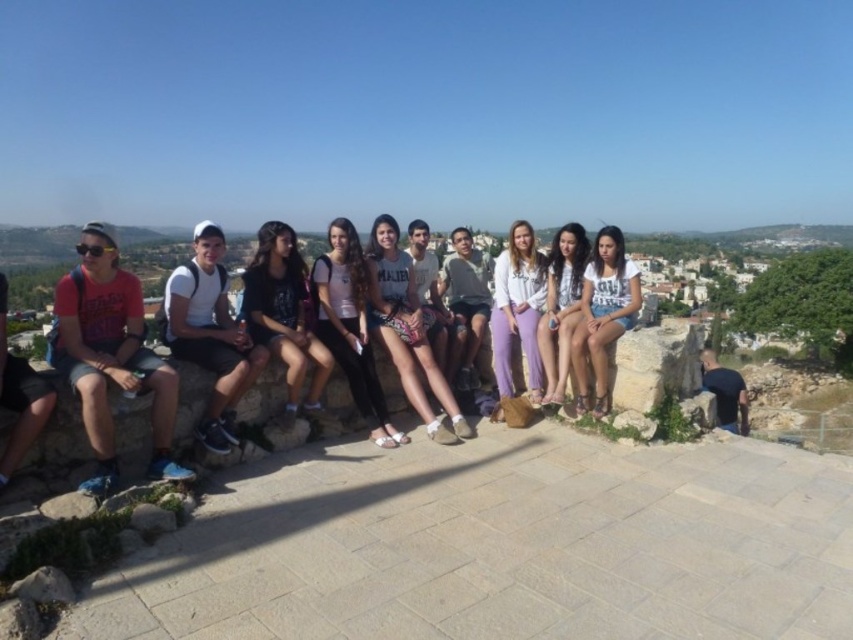
Question: Does white printed tank top at center appear on the right side of matte white shirt at center?

Choices:
 (A) yes
 (B) no

Answer: (A)

Question: Which point is closer to the camera taking this photo?

Choices:
 (A) (285, 376)
 (B) (184, 344)

Answer: (B)

Question: Does matte black jacket at center have a larger size compared to light purple cotton pants at center?

Choices:
 (A) yes
 (B) no

Answer: (A)

Question: Considering the relative positions of white printed tank top at center and matte white shirt at center in the image provided, where is white printed tank top at center located with respect to matte white shirt at center?

Choices:
 (A) below
 (B) above

Answer: (B)

Question: Which object is the farthest from the matte black jacket at center?

Choices:
 (A) light purple cotton pants at center
 (B) matte red t-shirt at left
 (C) white printed tank top at center
 (D) matte white shirt at center

Answer: (A)

Question: Which object is positioned farthest from the white matte shorts at center?

Choices:
 (A) matte black jacket at center
 (B) light purple cotton pants at center
 (C) matte white shirt at center
 (D) white printed tank top at center

Answer: (B)